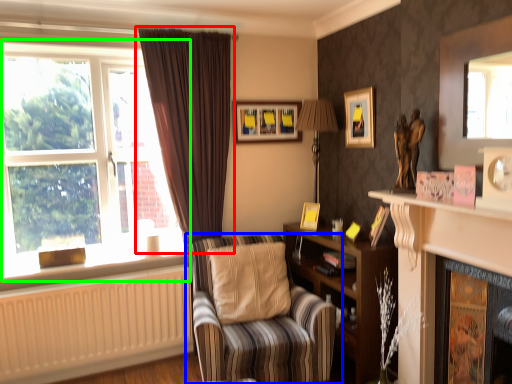
Question: Which object is the farthest from curtain (highlighted by a red box)? Choose among these: chair (highlighted by a blue box) or window (highlighted by a green box).

Choices:
 (A) chair
 (B) window

Answer: (A)